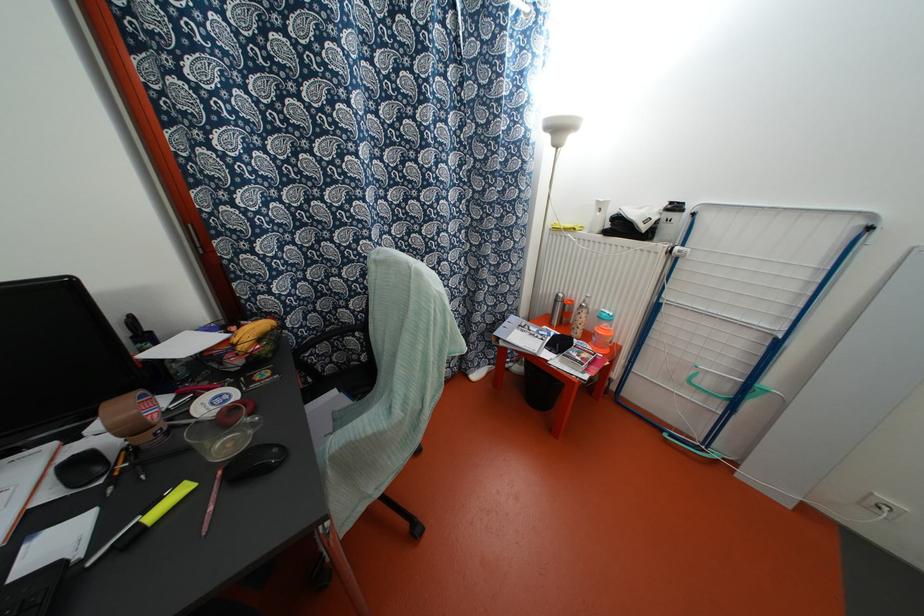
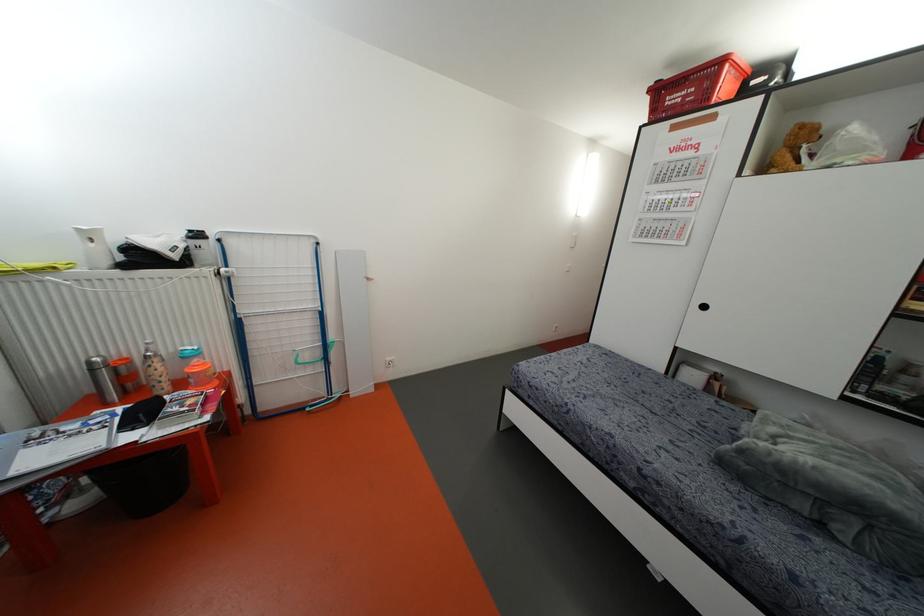
Question: How did the camera likely rotate?

Choices:
 (A) Left
 (B) Right
 (C) Up
 (D) Down

Answer: (B)